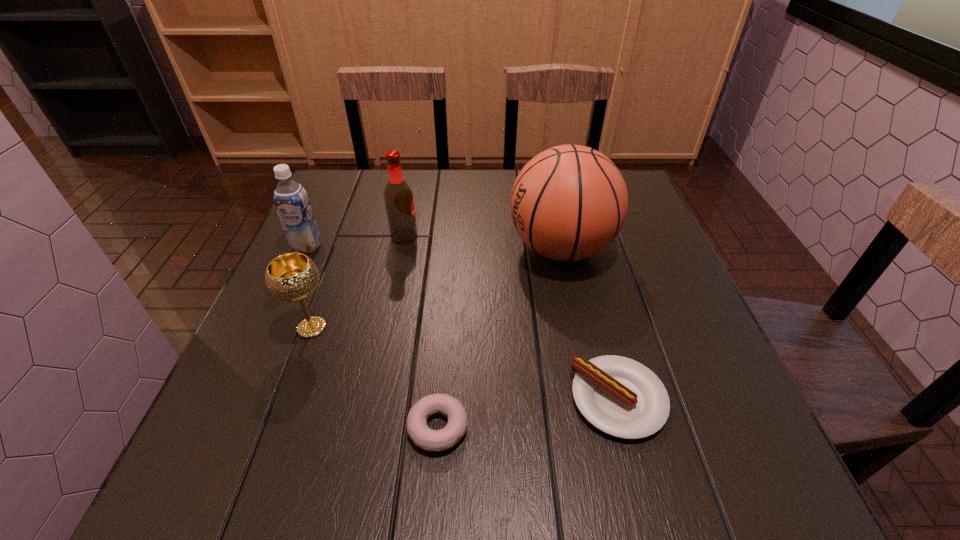
This screenshot has width=960, height=540. Identify the location of vacant space that satisfies the following two spatial constraints: 1. on the label of the leftmost object; 2. on the right side of the chalice. (271, 328).

Locate an element on the screen. The height and width of the screenshot is (540, 960). vacant space that satisfies the following two spatial constraints: 1. on the label of the soya milk; 2. on the left side of the fifth tallest object is located at coordinates (238, 399).

I want to click on free space that satisfies the following two spatial constraints: 1. on the label of the leftmost object; 2. on the right side of the fifth object from right to left, so click(x=271, y=328).